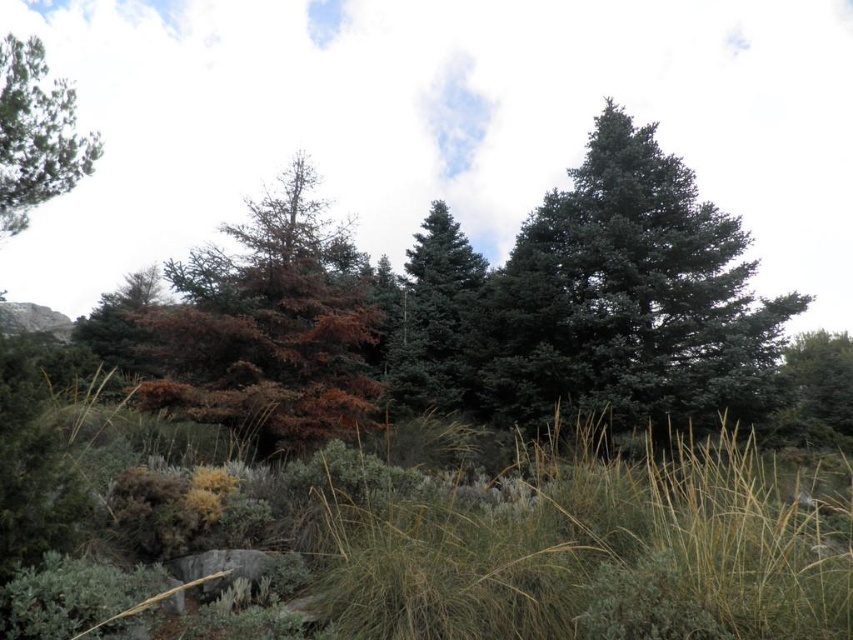
Question: Can you confirm if green fuzzy grass at center is wider than green matte tree at center?

Choices:
 (A) yes
 (B) no

Answer: (B)

Question: Is dark green fir tree at center above brown matte tree at left?

Choices:
 (A) no
 (B) yes

Answer: (A)

Question: Which is nearer to the brown matte tree at left?

Choices:
 (A) green matte tree at right
 (B) brown/dried leaves at center
 (C) dark green fir tree at center

Answer: (B)

Question: Considering the real-world distances, which object is closest to the green matte tree at upper left?

Choices:
 (A) brown matte tree at left
 (B) green matte tree at right

Answer: (A)

Question: Which point is closer to the camera?

Choices:
 (A) (802, 410)
 (B) (641, 160)
 (C) (264, 211)
 (D) (123, 365)

Answer: (C)

Question: From the image, what is the correct spatial relationship of brown/dried leaves at center in relation to green matte tree at upper left?

Choices:
 (A) right
 (B) left

Answer: (A)